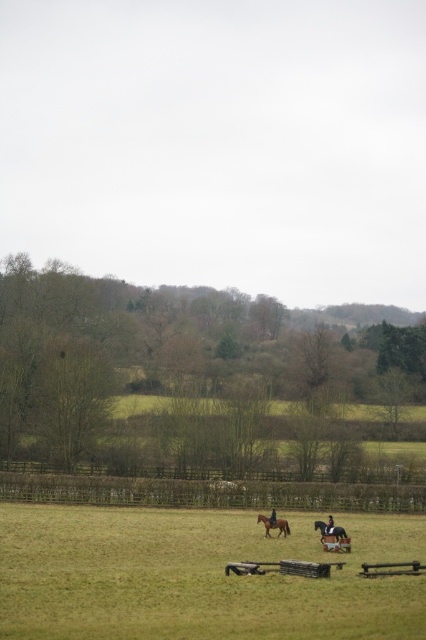
Question: Which point is farther to the camera?

Choices:
 (A) (403, 492)
 (B) (104, 556)

Answer: (A)

Question: Which point is closer to the camera?

Choices:
 (A) 333,529
 (B) 273,512
 (C) 258,518

Answer: (A)

Question: Is shiny brown horse at center closer to camera compared to shiny black jacket at center?

Choices:
 (A) yes
 (B) no

Answer: (A)

Question: Which point is farther from the camera taking this photo?

Choices:
 (A) (273, 515)
 (B) (285, 529)
 (C) (333, 525)

Answer: (B)

Question: Is brown glossy horse at center to the right of dark brown leather jacket at center from the viewer's perspective?

Choices:
 (A) yes
 (B) no

Answer: (B)

Question: Is the position of green grassy field at center more distant than that of brown glossy horse at center?

Choices:
 (A) no
 (B) yes

Answer: (A)